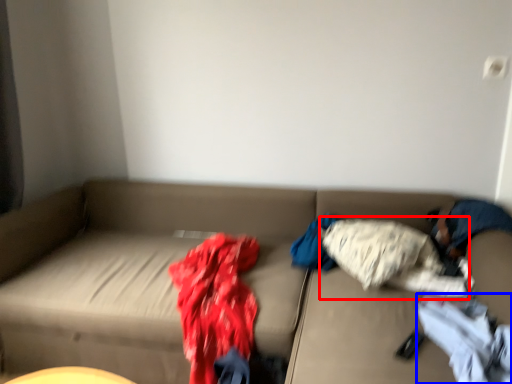
Question: Among these objects, which one is nearest to the camera, clothing (highlighted by a red box) or clothing (highlighted by a blue box)?

Choices:
 (A) clothing
 (B) clothing

Answer: (B)